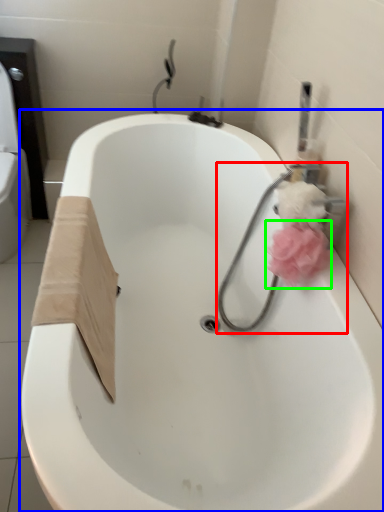
Question: Based on their relative distances, which object is nearer to plumbing fixture (highlighted by a red box)? Choose from bathtub (highlighted by a blue box) and flower (highlighted by a green box).

Choices:
 (A) bathtub
 (B) flower

Answer: (B)